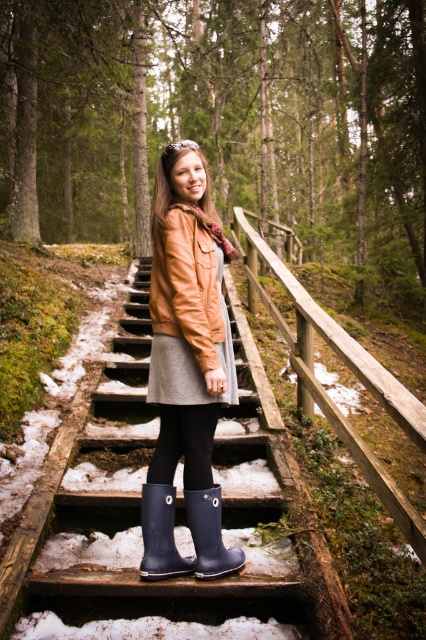
You are a hiker who wants to climb up the wooden stairs at center. The leather jacket at center is blocking your path. Can you step over it?

The wooden stairs at center is located below leather jacket at center, so the leather jacket is above the stairs. Therefore, you cannot step over the leather jacket at center because it is not in your way on the stairs.